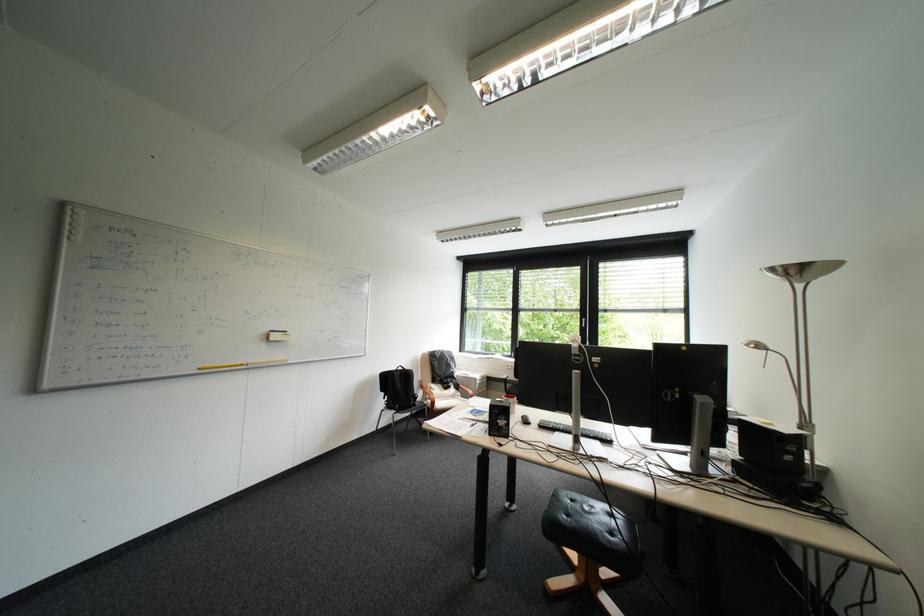
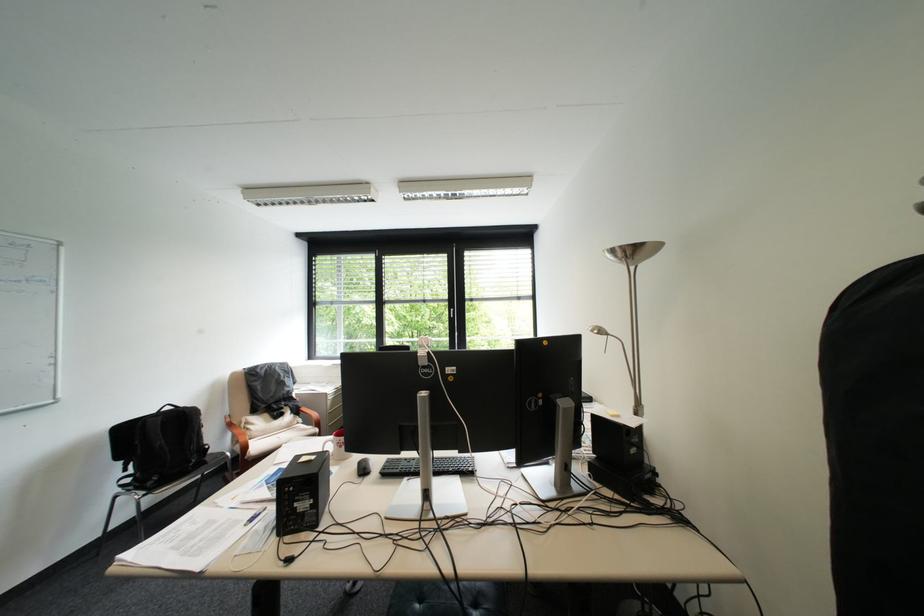
The point at (603, 436) is marked in the first image. Where is the corresponding point in the second image?

(463, 469)